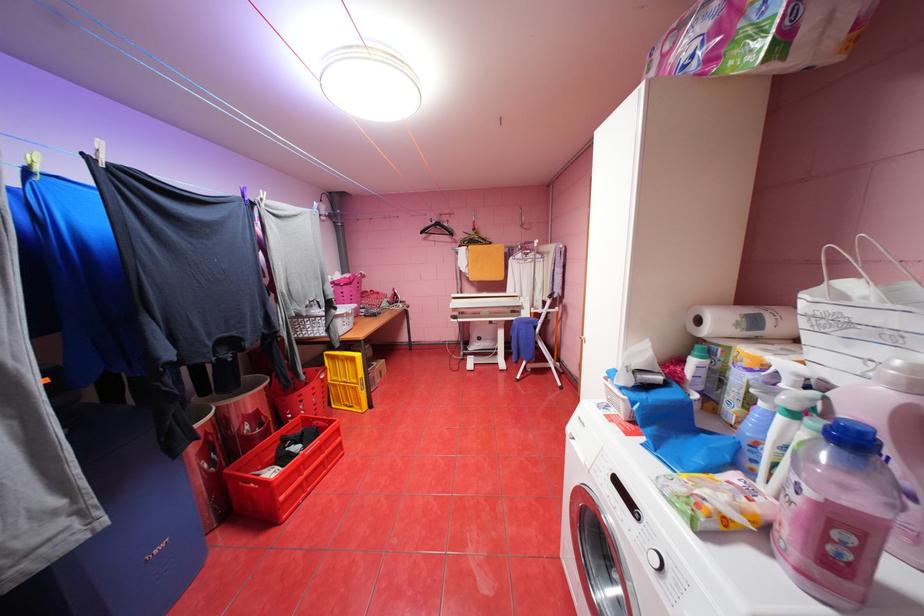
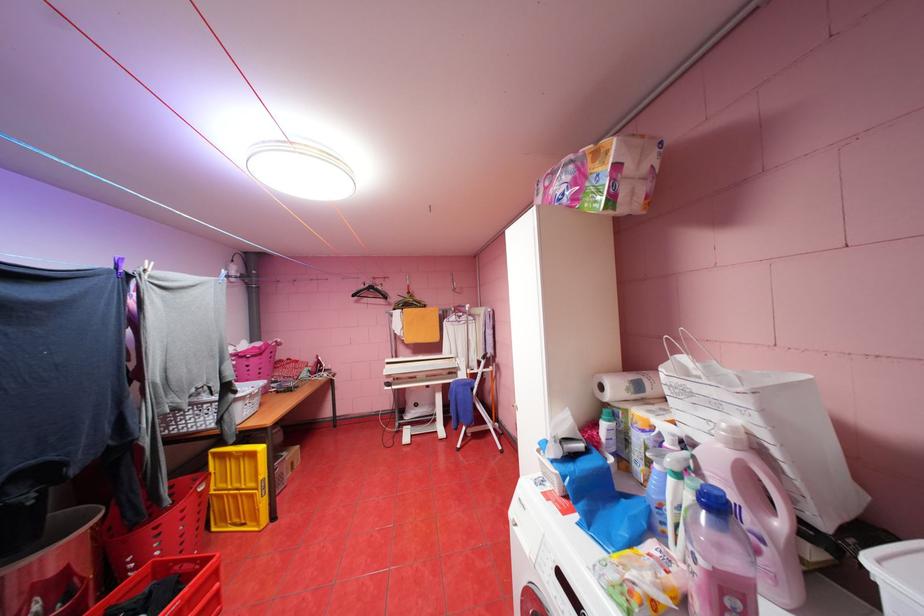
Locate, in the second image, the point that corresponds to point 314,421 in the first image.

(169, 569)